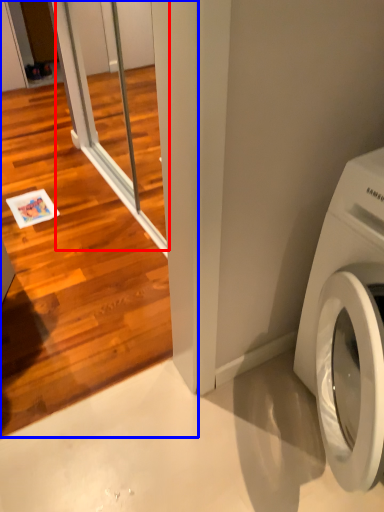
Question: Which object appears farthest to the camera in this image, screen door (highlighted by a red box) or screen door (highlighted by a blue box)?

Choices:
 (A) screen door
 (B) screen door

Answer: (A)